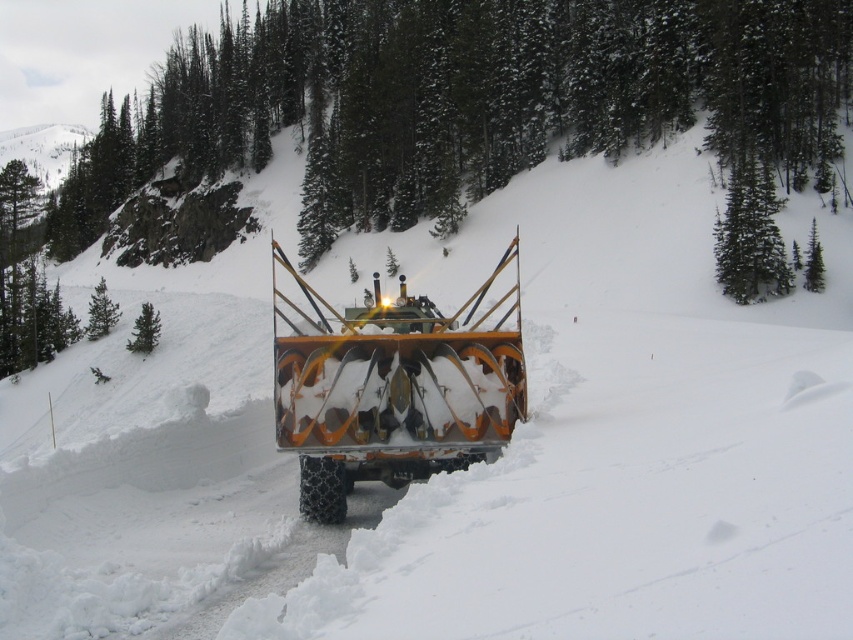
You are a snowplow operator who needs to clear a path from the orange metallic snowplow at center to the green textured pine at center. Given that your vehicle can only move in a straight line and has a turning radius of 30 feet, can you safely navigate to the pine without hitting it?

The distance between the orange metallic snowplow at center and the green textured pine at center is 128.90 feet. Since the vehicle has a turning radius of 30 feet, it can safely navigate to the pine without hitting it as the distance is more than sufficient for the required turning radius.

You are a hiker trying to navigate through the snowy mountain path. You see the green textured pine at center and the green textured pine tree at upper right. Which pine tree would you choose as a reference point for your path if you want to stay closer to the shorter tree?

You should choose the green textured pine tree at upper right as your reference point because it is shorter than the green textured pine at center.

You are a snowplow operator trying to navigate through the snowy terrain. You notice two points marked on your GPS map at coordinates point (418, 128) and point (485, 401). Which point is closer to your current position as the snowplow operator?

Point (418, 128) is closer to your current position because it is further to the viewer than point (485, 401), meaning it is nearer to you.